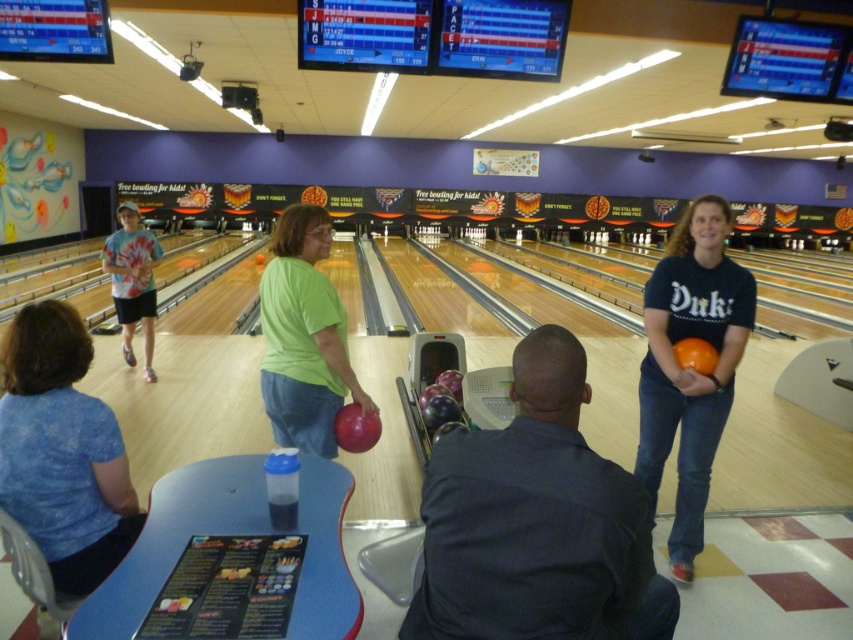
Question: Where is dark blue shirt at center located in relation to tie-dye fabric shirt at left in the image?

Choices:
 (A) below
 (B) above

Answer: (A)

Question: Which point is closer to the camera taking this photo?

Choices:
 (A) (689, 372)
 (B) (132, 358)
 (C) (299, 250)

Answer: (A)

Question: Which object is closer to the camera taking this photo?

Choices:
 (A) orange matte bowling ball at right
 (B) green matte bowling ball at center

Answer: (A)

Question: Is orange matte bowling ball at right bigger than tie-dye fabric shirt at left?

Choices:
 (A) yes
 (B) no

Answer: (A)

Question: Can you confirm if blue fabric shirt at lower left is positioned to the right of orange matte bowling ball at right?

Choices:
 (A) yes
 (B) no

Answer: (B)

Question: Among these objects, which one is farthest from the camera?

Choices:
 (A) orange matte bowling ball at right
 (B) blue fabric shirt at lower left
 (C) dark blue shirt at center
 (D) green matte bowling ball at center

Answer: (D)